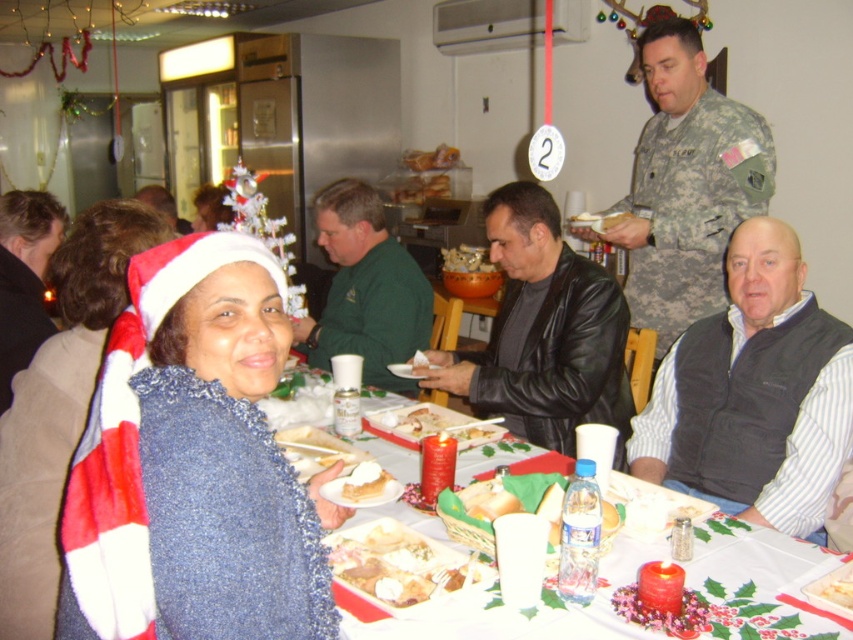
Does point (300, 344) come in front of point (39, 237)?

That is False.

Is green matte shirt at center shorter than brown hair at left?

Incorrect, green matte shirt at center's height does not fall short of brown hair at left's.

Who is more distant from viewer, (352,193) or (25,292)?

The point (352,193) is more distant.

Find the location of a particular element. The image size is (853, 640). green matte shirt at center is located at coordinates (364, 289).

Who is shorter, camouflage uniform at upper right or green matte shirt at center?

With less height is green matte shirt at center.

Between camouflage uniform at upper right and green matte shirt at center, which one is positioned higher?

Positioned higher is camouflage uniform at upper right.

Who is more distant from viewer, (656, 168) or (373, 198)?

The point (373, 198) is more distant.

This screenshot has height=640, width=853. I want to click on camouflage uniform at upper right, so click(685, 186).

Does white paper plate at lower left appear on the right side of white bread at table?

Incorrect, white paper plate at lower left is not on the right side of white bread at table.

Is white paper plate at lower left further to the viewer compared to white bread at table?

No, it is not.

Describe the element at coordinates (746, 556) in the screenshot. I see `white paper plate at lower left` at that location.

Locate an element on the screen. This screenshot has height=640, width=853. white paper plate at lower left is located at coordinates (746, 556).